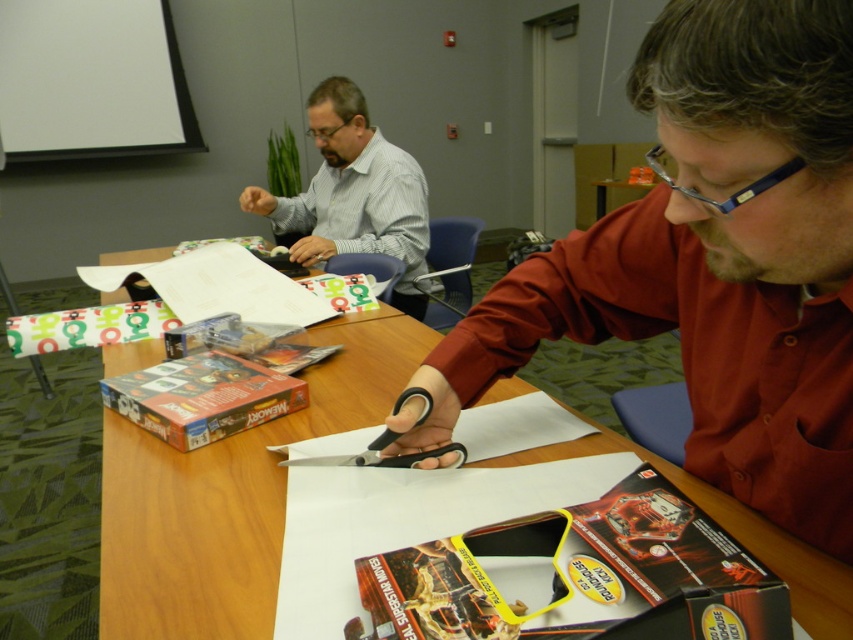
Does matte plastic board game at center appear over matte gray shirt at upper left?

Incorrect, matte plastic board game at center is not positioned above matte gray shirt at upper left.

Find the location of a particular element. matte plastic board game at center is located at coordinates tap(578, 577).

Does wooden table at center have a lesser height compared to matte gray shirt at upper left?

Indeed, wooden table at center has a lesser height compared to matte gray shirt at upper left.

The width and height of the screenshot is (853, 640). Describe the element at coordinates (230, 496) in the screenshot. I see `wooden table at center` at that location.

Where is `wooden table at center`? This screenshot has width=853, height=640. wooden table at center is located at coordinates (230, 496).

Does white paper at center have a larger size compared to black plastic scissors at center?

Yes, white paper at center is bigger than black plastic scissors at center.

Between point (172, 276) and point (393, 467), which one is positioned in front?

Point (393, 467) is in front.

Image resolution: width=853 pixels, height=640 pixels. Identify the location of white paper at center. (218, 285).